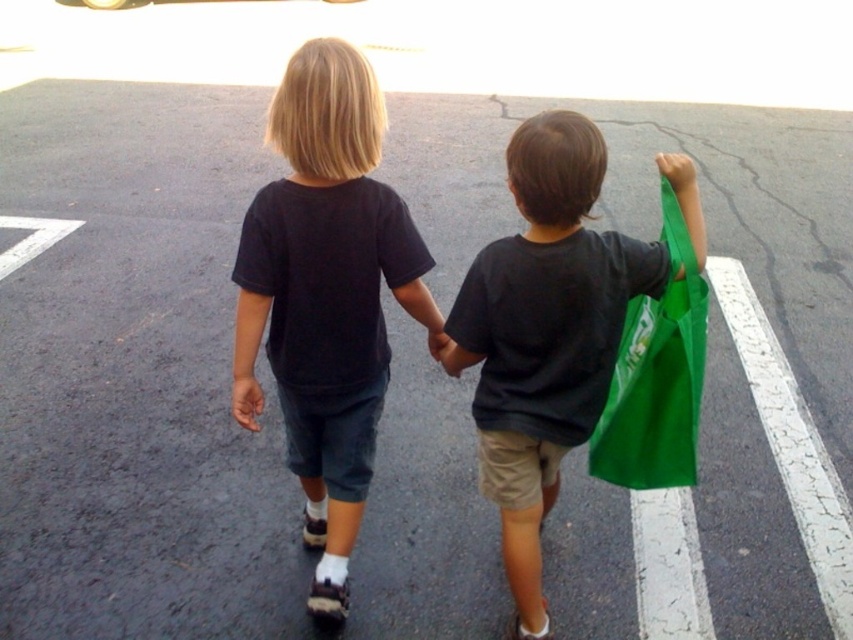
You need to know if the green matte bag at right can be held in the matte skin hand at center. Based on their widths, will it fit?

The green matte bag at right is wider than the matte skin hand at center, so it cannot fit in the hand.

You are a photographer trying to capture a candid shot of the two children walking away. You want to ensure that both the black cotton shirt at center and the matte skin hand at center are in focus. Given that your camera has a depth of field that can cover objects within 30 centimeters of each other, will you be able to achieve this?

The black cotton shirt at center and the matte skin hand at center are 33.84 centimeters apart. Since the distance between them exceeds the camera lens depth of field coverage of 30 centimeters, it might be challenging to have both in focus simultaneously. Consider adjusting your camera settings or moving closer to reduce the distance between the subjects in the frame.

You are a photographer trying to capture both the black cotton shirt at center and the green fabric bag at upper right in the same frame. Based on their positions, which object should you focus on first to ensure both are in the frame?

→ The black cotton shirt at center is located below the green fabric bag at upper right, so you should focus on the green fabric bag at upper right first to ensure both are in the frame.